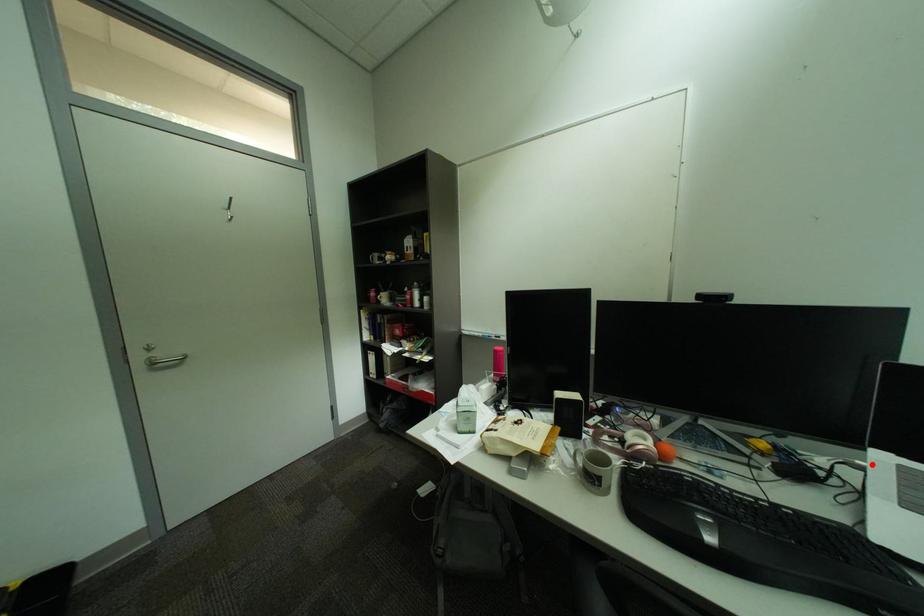
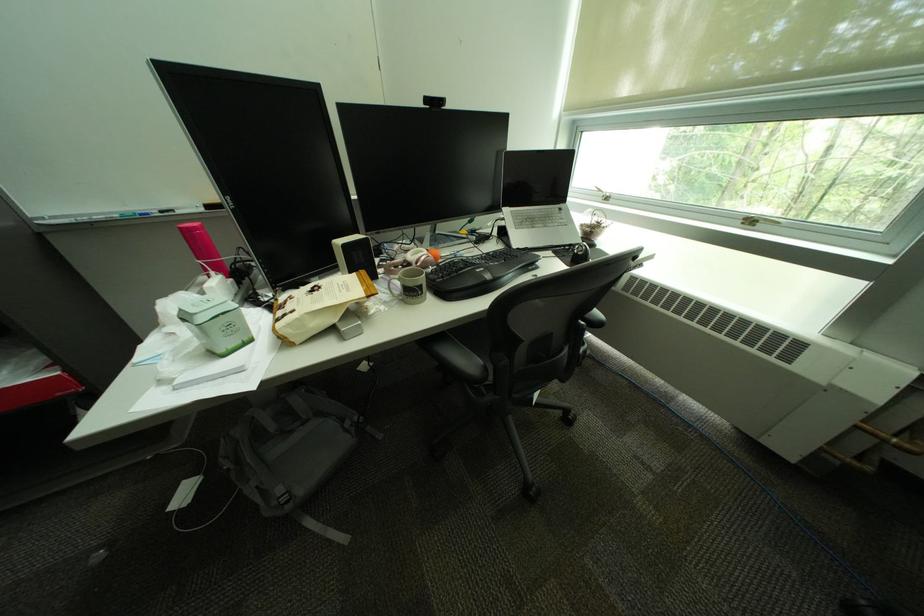
Question: I am providing you with two images of the same scene from different viewpoints. A red point is marked on the first image. At the location where the point appears in image 1, is it still visible in image 2?

Choices:
 (A) Yes
 (B) No

Answer: (A)